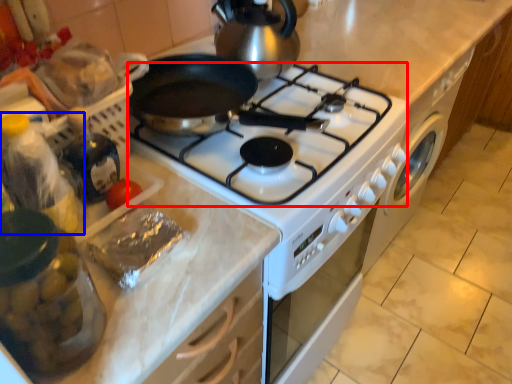
Question: Among these objects, which one is nearest to the camera, gas stove (highlighted by a red box) or bottle (highlighted by a blue box)?

Choices:
 (A) gas stove
 (B) bottle

Answer: (B)